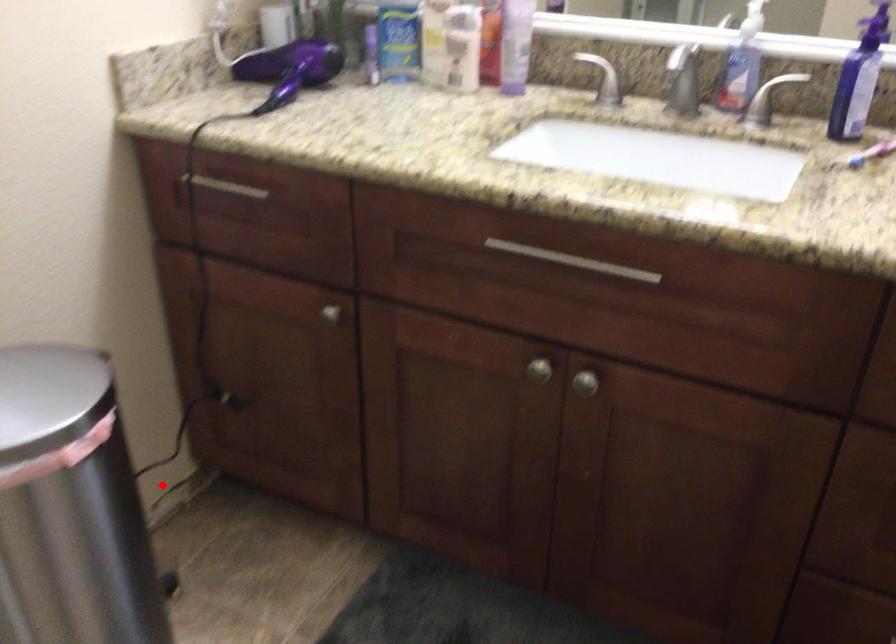
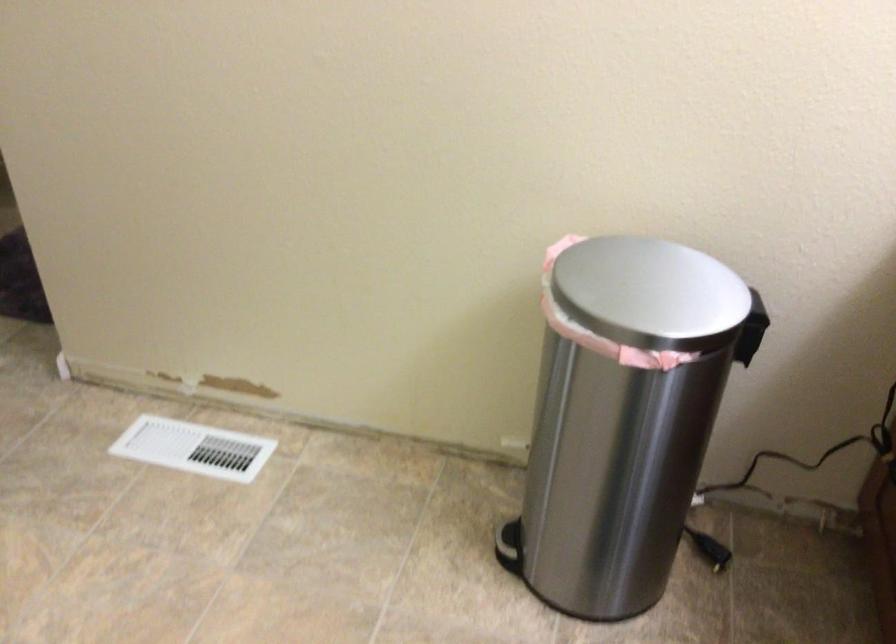
In the second image, find the point that corresponds to the highlighted location in the first image.

(794, 483)